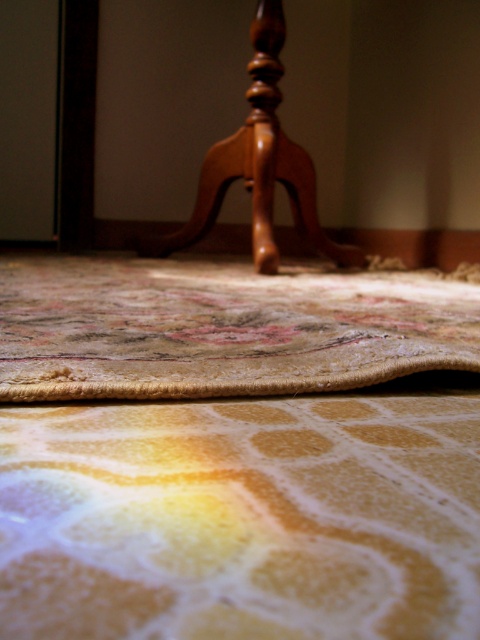
You are standing in the room and want to move from the carpeted floor at center to the polished wood chair at upper center. Which direction should you move to reach the chair?

You should move backward because the carpeted floor at center is in front of the polished wood chair at upper center, meaning the chair is behind you relative to your current position on the carpeted floor at center.